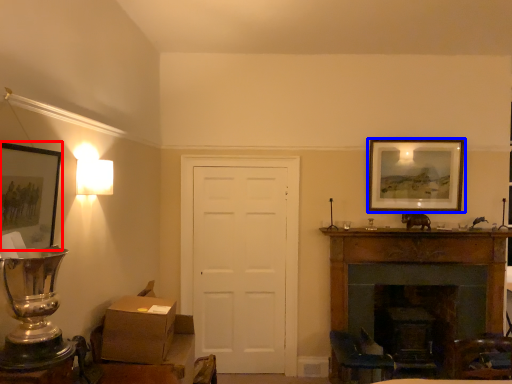
Question: Among these objects, which one is nearest to the camera, picture frame (highlighted by a red box) or picture frame (highlighted by a blue box)?

Choices:
 (A) picture frame
 (B) picture frame

Answer: (A)